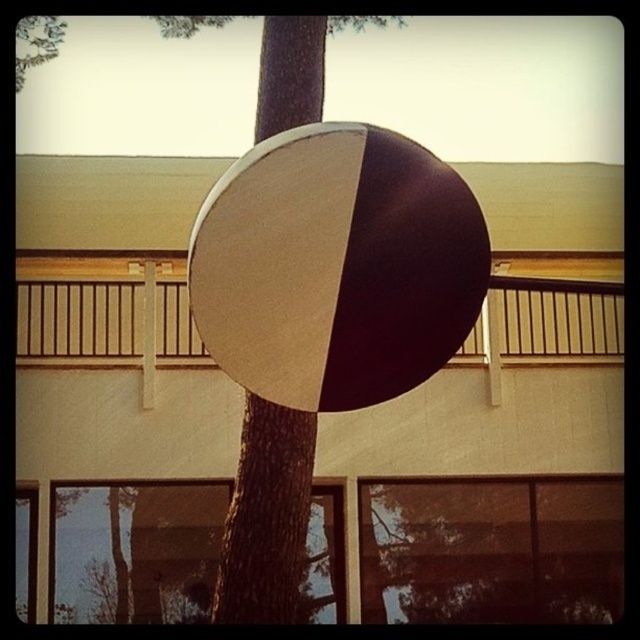
Is matte white and dark brown beach ball at center taller than wooden at center?

No, matte white and dark brown beach ball at center is not taller than wooden at center.

Can you confirm if matte white and dark brown beach ball at center is positioned below wooden at center?

No, matte white and dark brown beach ball at center is not below wooden at center.

Identify the location of matte white and dark brown beach ball at center. (337, 266).

I want to click on matte white and dark brown beach ball at center, so (337, 266).

Is point (353, 246) positioned in front of point (289, 28)?

Yes, point (353, 246) is in front of point (289, 28).

Is matte white and dark brown beach ball at center below brown textured tree trunk at center?

Yes, matte white and dark brown beach ball at center is below brown textured tree trunk at center.

Who is more forward, (332, 134) or (269, 596)?

Point (332, 134) is more forward.

This screenshot has height=640, width=640. Find the location of `matte white and dark brown beach ball at center`. matte white and dark brown beach ball at center is located at coordinates (337, 266).

Which is behind, point (316, 77) or point (99, 352)?

The point (99, 352) is more distant.

Does brown textured tree trunk at center have a greater height compared to wooden at center?

Indeed, brown textured tree trunk at center has a greater height compared to wooden at center.

Who is more distant from viewer, (x=259, y=468) or (x=138, y=330)?

Point (x=138, y=330)

Where is `brown textured tree trunk at center`? brown textured tree trunk at center is located at coordinates (266, 516).